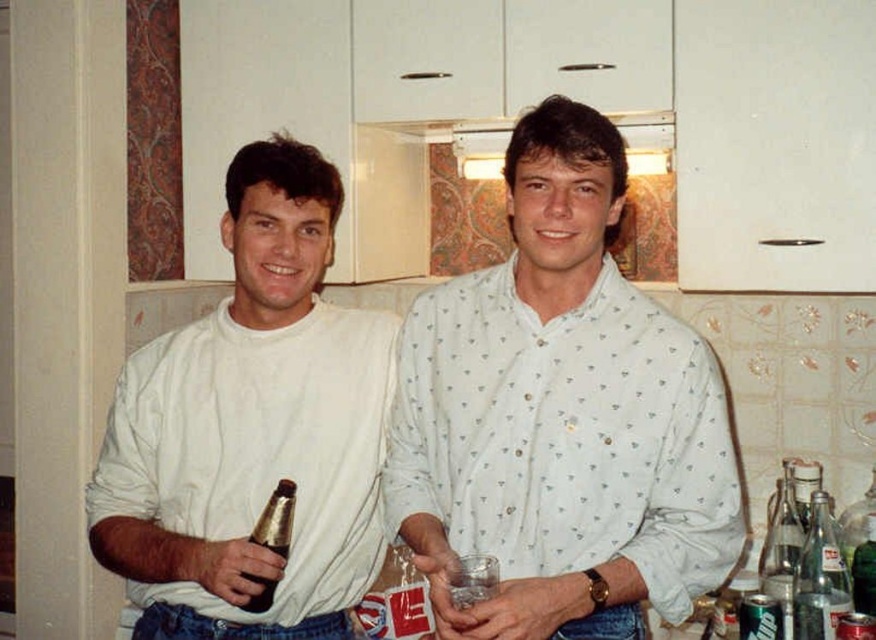
Which is behind, point (147, 374) or point (272, 584)?

The point (147, 374) is behind.

Does point (154, 493) come closer to viewer compared to point (287, 550)?

No.

Identify the location of white matte shirt at left. The image size is (876, 640). (251, 428).

Does white matte shirt at left have a lesser height compared to clear glass soda bottle at right?

Incorrect, white matte shirt at left's height does not fall short of clear glass soda bottle at right's.

Where is `white matte shirt at left`? white matte shirt at left is located at coordinates (251, 428).

Is clear glass soda bottle at right below clear glass soda at right?

No.

In order to click on clear glass soda bottle at right in this screenshot , I will do `click(818, 577)`.